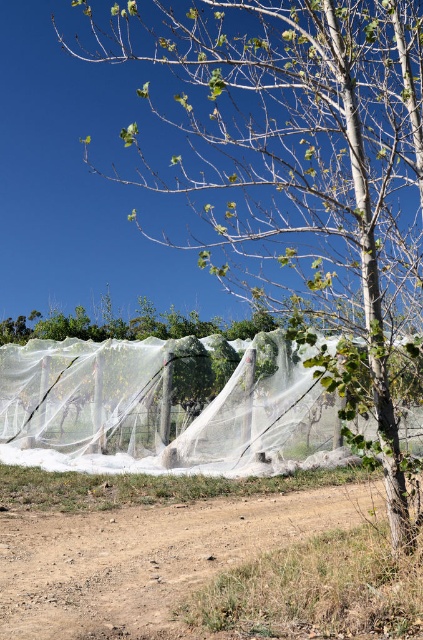
Question: Can you confirm if brown dirt field at lower center is positioned above transparent nylon net at center?

Choices:
 (A) no
 (B) yes

Answer: (A)

Question: Where is brown dirt field at lower center located in relation to transparent nylon net at center in the image?

Choices:
 (A) below
 (B) above

Answer: (A)

Question: Which object is closer to the camera taking this photo?

Choices:
 (A) transparent nylon net at center
 (B) brown dirt field at lower center

Answer: (B)

Question: Does brown dirt field at lower center lie in front of transparent nylon net at center?

Choices:
 (A) no
 (B) yes

Answer: (B)